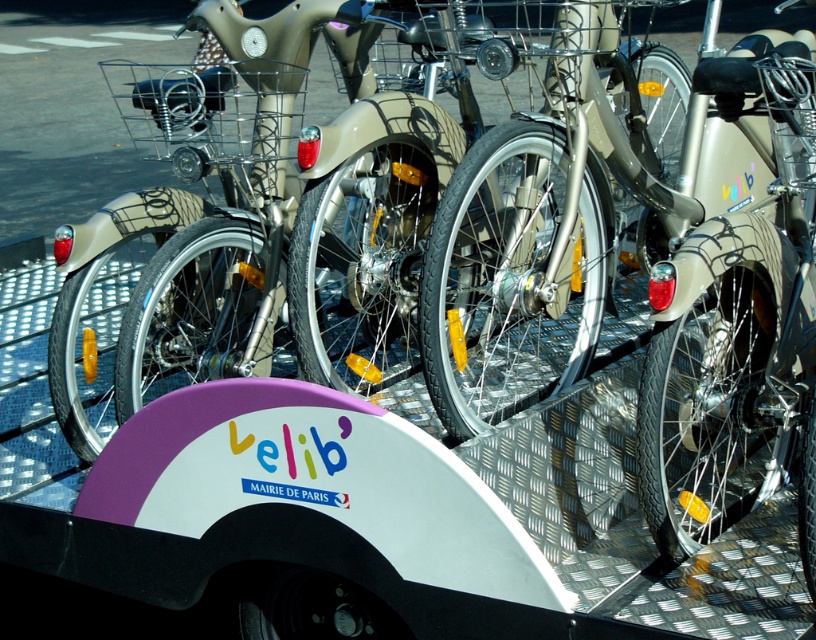
Is point (605, 120) more distant than point (738, 292)?

Yes, it is behind point (738, 292).

Who is higher up, matte beige bicycle at center or matte silver bicycle at center?

Positioned higher is matte beige bicycle at center.

Who is more forward, [459,301] or [774,211]?

Positioned in front is point [774,211].

Locate an element on the screen. The width and height of the screenshot is (816, 640). matte beige bicycle at center is located at coordinates (582, 198).